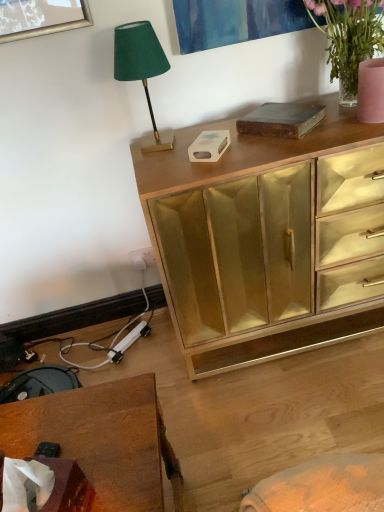
Image resolution: width=384 pixels, height=512 pixels. Identify the location of free space in front of green velvet lampshade at upper left. (164, 167).